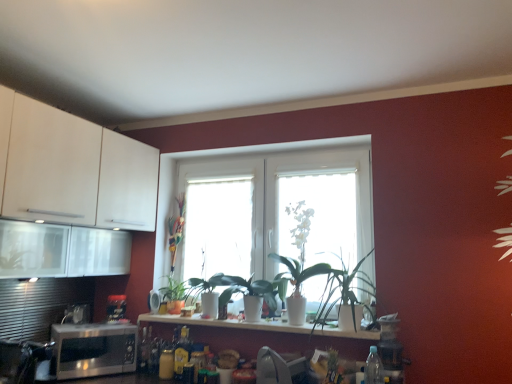
At what (x,y) coordinates should I click in order to perform the action: click on vacant point above white glossy vase at center, the 3th window in the left-to-right sequence (from a real-world perspective). Please return your answer as a coordinate pair (x, y). Looking at the image, I should click on (314, 172).